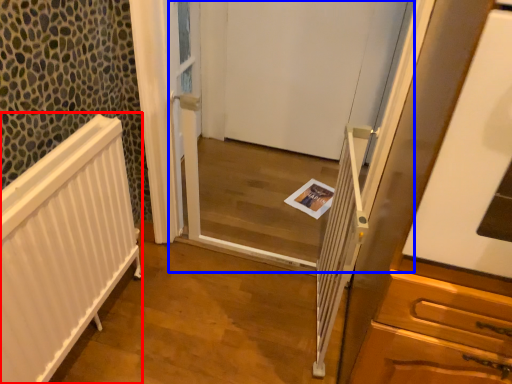
Question: Which object is further to the camera taking this photo, radiator (highlighted by a red box) or screen door (highlighted by a blue box)?

Choices:
 (A) radiator
 (B) screen door

Answer: (B)